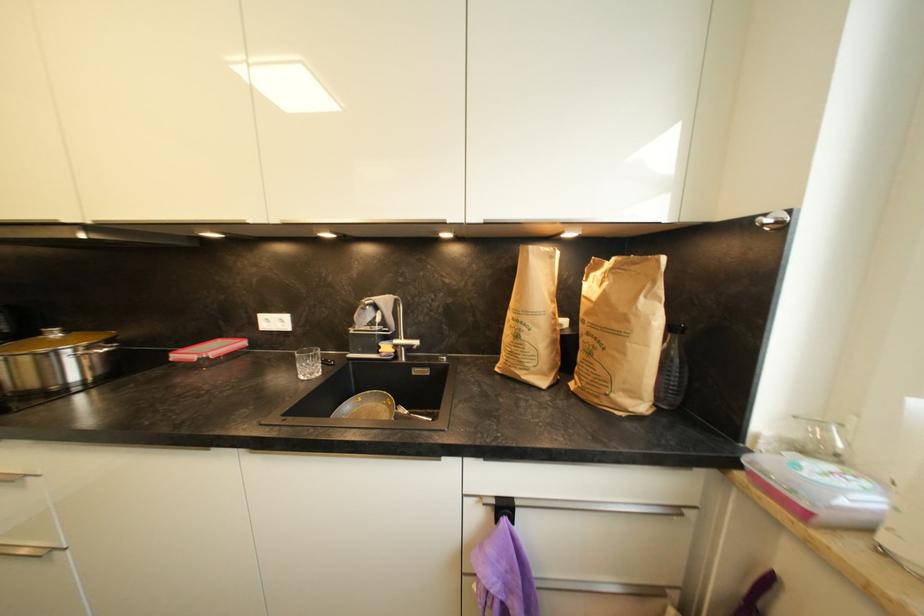
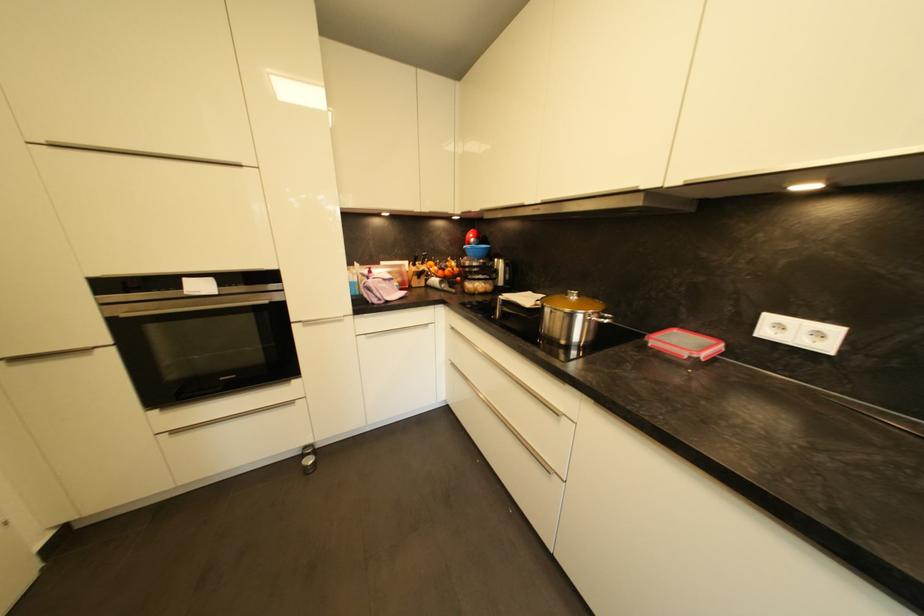
In the second image, find the point that corresponds to point (106, 350) in the first image.

(610, 320)